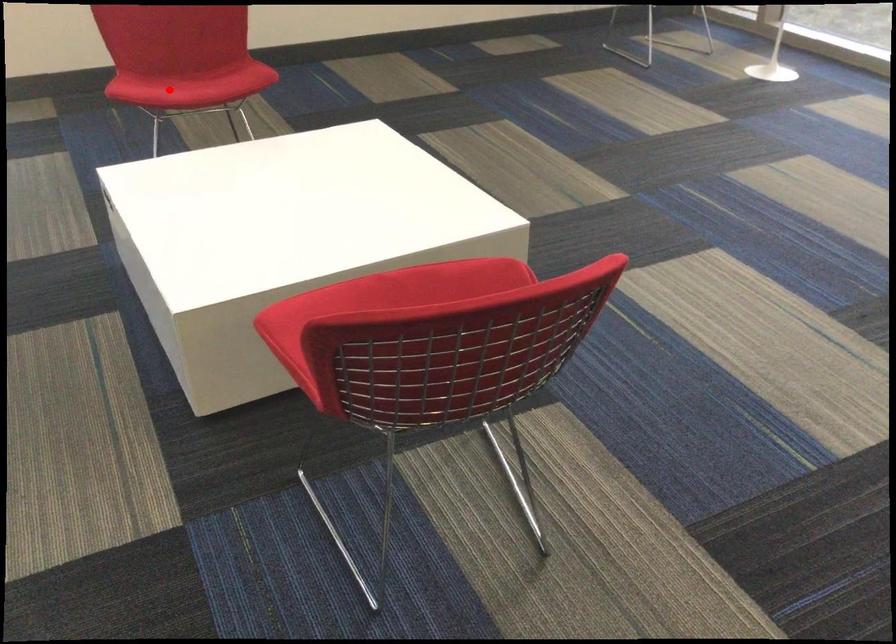
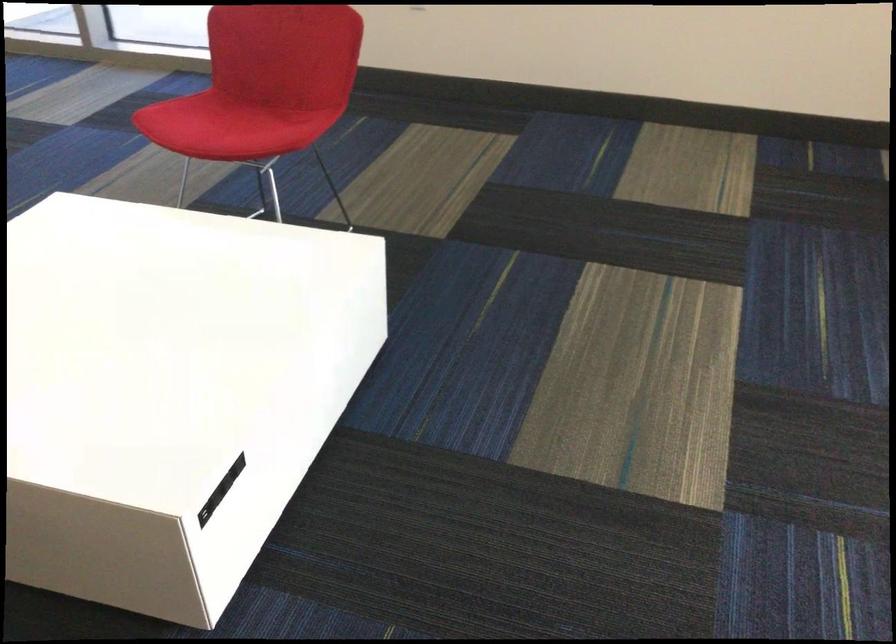
Locate, in the second image, the point that corresponds to the highlighted location in the first image.

(225, 124)